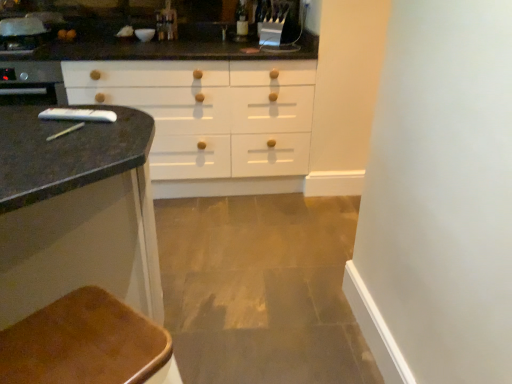
This screenshot has width=512, height=384. I want to click on brown leather chair at lower left, so click(x=86, y=344).

Image resolution: width=512 pixels, height=384 pixels. Describe the element at coordinates (86, 344) in the screenshot. I see `brown leather chair at lower left` at that location.

The width and height of the screenshot is (512, 384). What do you see at coordinates (167, 23) in the screenshot?
I see `metallic faucet at upper center` at bounding box center [167, 23].

Identify the location of metallic faucet at upper center. The height and width of the screenshot is (384, 512). click(x=167, y=23).

Where is `brown leather chair at lower left`? brown leather chair at lower left is located at coordinates (86, 344).

From the picture: Considering the relative positions of brown leather chair at lower left and metallic faucet at upper center in the image provided, is brown leather chair at lower left to the left of metallic faucet at upper center from the viewer's perspective?

In fact, brown leather chair at lower left is to the right of metallic faucet at upper center.

Is the position of brown leather chair at lower left more distant than that of metallic faucet at upper center?

No, it is not.

Is point (28, 317) positioned before point (170, 31)?

Yes.

From the image's perspective, is brown leather chair at lower left above or below metallic faucet at upper center?

Clearly, from the image's perspective, brown leather chair at lower left is below metallic faucet at upper center.

From a real-world perspective, who is located higher, brown leather chair at lower left or metallic faucet at upper center?

From a 3D spatial view, metallic faucet at upper center is above.

Is brown leather chair at lower left wider than metallic faucet at upper center?

Yes, brown leather chair at lower left is wider than metallic faucet at upper center.

Does brown leather chair at lower left have a lesser height compared to metallic faucet at upper center?

Incorrect, the height of brown leather chair at lower left does not fall short of that of metallic faucet at upper center.

Considering the sizes of objects brown leather chair at lower left and metallic faucet at upper center in the image provided, who is smaller, brown leather chair at lower left or metallic faucet at upper center?

metallic faucet at upper center.

Does brown leather chair at lower left contain metallic faucet at upper center?

No, metallic faucet at upper center is located outside of brown leather chair at lower left.

Are brown leather chair at lower left and metallic faucet at upper center making contact?

No.

Could you tell me if brown leather chair at lower left is turned towards metallic faucet at upper center?

No, brown leather chair at lower left is not turned towards metallic faucet at upper center.

Locate an element on the screen. faucet on the left of the brown leather chair at lower left is located at coordinates (167, 23).

Visually, is metallic faucet at upper center positioned to the left or to the right of brown leather chair at lower left?

In the image, metallic faucet at upper center appears on the left side of brown leather chair at lower left.

Which object is closer to the camera, metallic faucet at upper center or brown leather chair at lower left?

brown leather chair at lower left.

Which point is more forward, (164, 34) or (134, 311)?

The point (134, 311) is more forward.

From the image's perspective, is metallic faucet at upper center under brown leather chair at lower left?

Actually, metallic faucet at upper center appears above brown leather chair at lower left in the image.

From a real-world perspective, does metallic faucet at upper center stand above brown leather chair at lower left?

Indeed, from a real-world perspective, metallic faucet at upper center stands above brown leather chair at lower left.

Is metallic faucet at upper center wider than brown leather chair at lower left?

No, metallic faucet at upper center is not wider than brown leather chair at lower left.

In terms of height, does metallic faucet at upper center look taller or shorter compared to brown leather chair at lower left?

Clearly, metallic faucet at upper center is shorter compared to brown leather chair at lower left.

In terms of size, does metallic faucet at upper center appear bigger or smaller than brown leather chair at lower left?

Clearly, metallic faucet at upper center is smaller in size than brown leather chair at lower left.

Is brown leather chair at lower left inside metallic faucet at upper center?

No, metallic faucet at upper center does not contain brown leather chair at lower left.

Are metallic faucet at upper center and brown leather chair at lower left located far from each other?

That's right, there is a large distance between metallic faucet at upper center and brown leather chair at lower left.

Is metallic faucet at upper center positioned with its back to brown leather chair at lower left?

No, brown leather chair at lower left is not at the back of metallic faucet at upper center.

How many degrees apart are the facing directions of metallic faucet at upper center and brown leather chair at lower left?

metallic faucet at upper center and brown leather chair at lower left are facing 43.9 degrees away from each other.

Find the location of a particular element. faucet above the brown leather chair at lower left (from a real-world perspective) is located at coordinates (167, 23).

This screenshot has height=384, width=512. I want to click on faucet on the left of brown leather chair at lower left, so click(x=167, y=23).

Where is `faucet behind the brown leather chair at lower left`? faucet behind the brown leather chair at lower left is located at coordinates (167, 23).